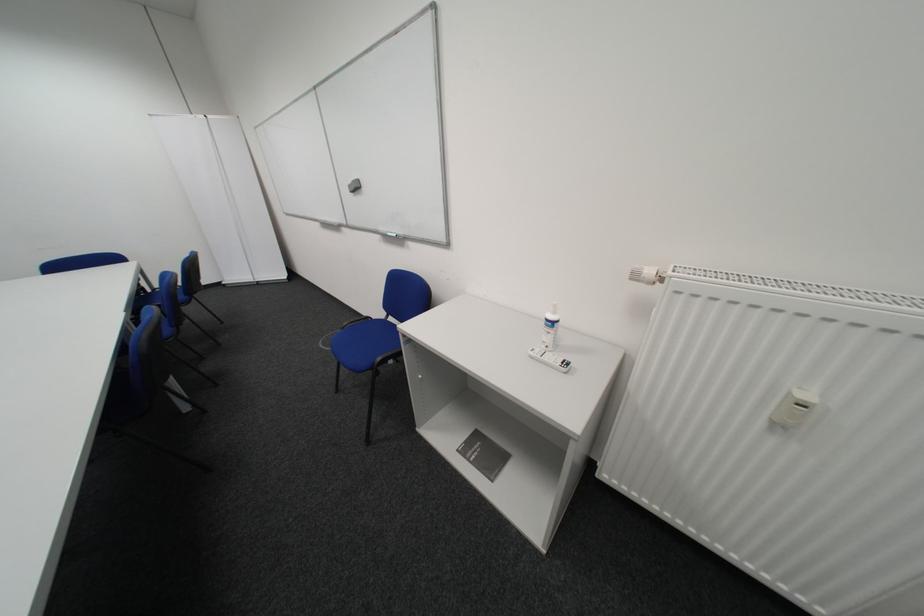
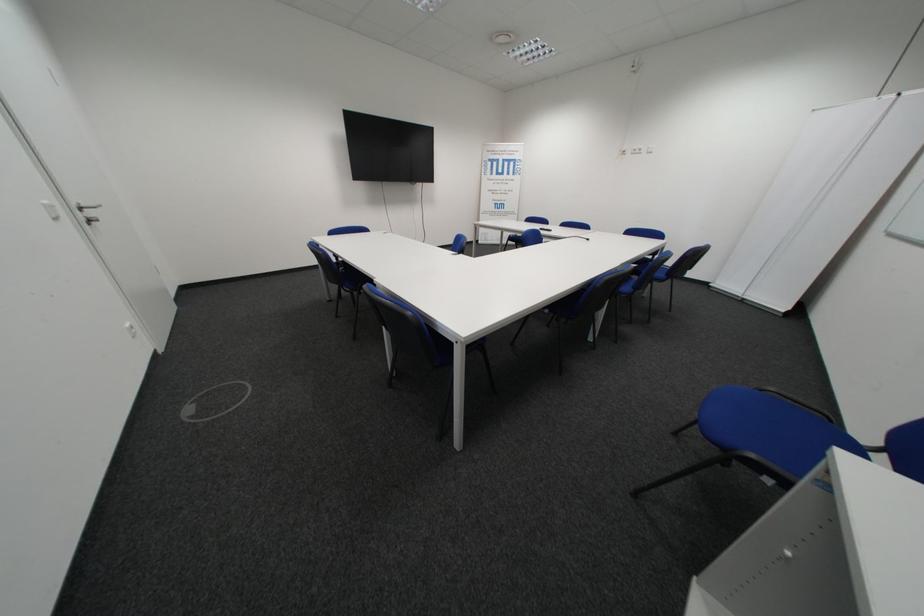
In the second image, find the point that corresponds to (x=392, y=360) in the first image.

(761, 456)